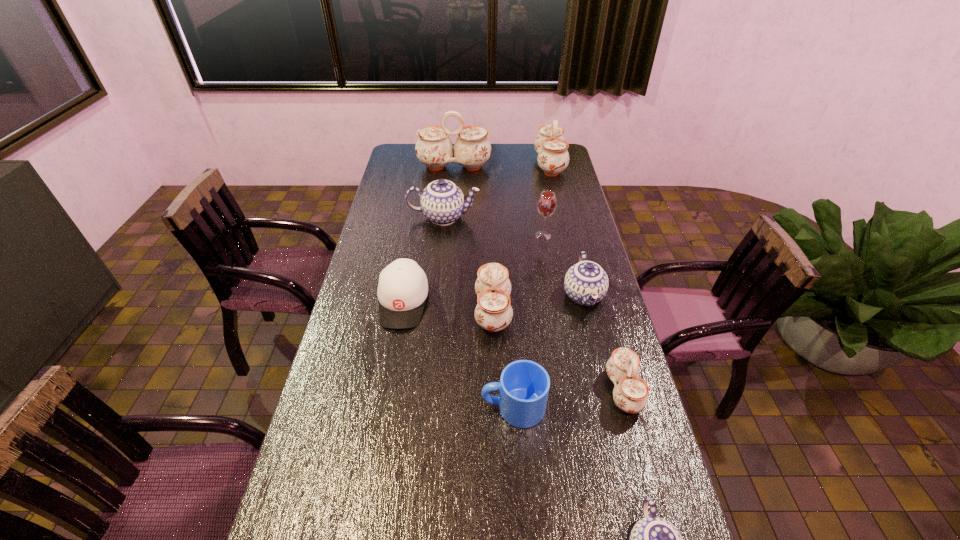
Find the location of a particular element. This screenshot has width=960, height=540. baseball cap present at the left edge is located at coordinates (403, 287).

Locate an element on the screen. This screenshot has width=960, height=540. wineglass positioned at the right edge is located at coordinates (547, 203).

This screenshot has width=960, height=540. Identify the location of object present at the far left corner. (472, 148).

Image resolution: width=960 pixels, height=540 pixels. In order to click on object that is at the far right corner in this screenshot , I will do [553, 157].

Locate an element on the screen. vacant space at the left edge is located at coordinates (394, 200).

In the image, there is a desktop. Where is `vacant space at the right edge`? This screenshot has width=960, height=540. vacant space at the right edge is located at coordinates coord(557,231).

This screenshot has width=960, height=540. What are the coordinates of `vacant space at the far left corner of the desktop` in the screenshot? It's located at (406, 147).

Image resolution: width=960 pixels, height=540 pixels. In order to click on vacant space that's between the second smallest white chinaware and the white baseball cap in this screenshot , I will do `click(448, 307)`.

Locate an element on the screen. The image size is (960, 540). vacant space in between the second nearest chinaware and the mug is located at coordinates click(x=568, y=399).

Locate an element on the screen. This screenshot has height=540, width=960. free space between the mug and the white baseball cap is located at coordinates (458, 355).